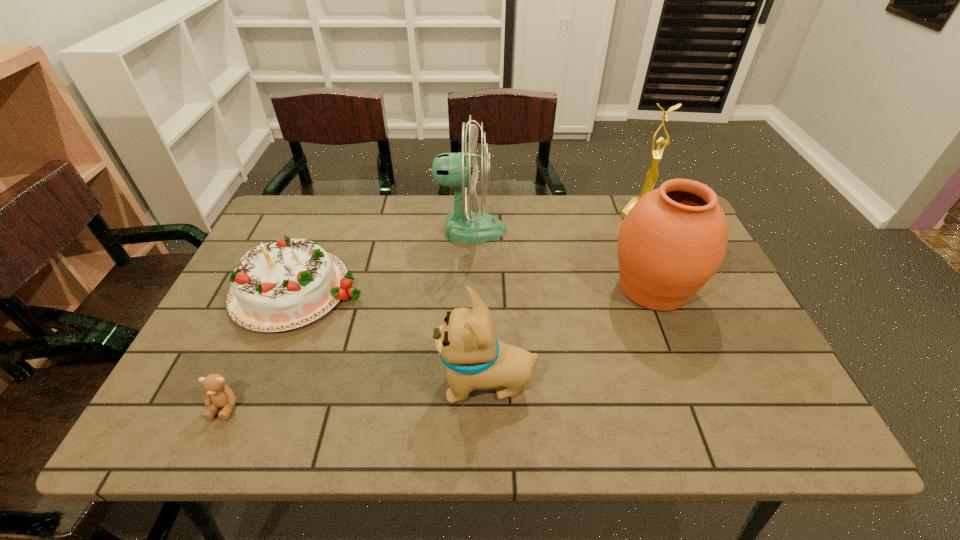
What are the coordinates of `free space that satisfies the following two spatial constraints: 1. in front of the fan, directing airflow; 2. on the front side of the second shortest object` in the screenshot? It's located at (468, 288).

Find the location of a particular element. free space that satisfies the following two spatial constraints: 1. on the face of the fourth tallest object; 2. on the face of the teddy bear is located at coordinates (487, 407).

I want to click on free spot that satisfies the following two spatial constraints: 1. on the face of the puppy; 2. on the face of the teddy bear, so click(x=487, y=407).

The width and height of the screenshot is (960, 540). Identify the location of vacant region that satisfies the following two spatial constraints: 1. in front of the fan, directing airflow; 2. on the back side of the urn. pyautogui.click(x=468, y=287).

Where is `free location that satisfies the following two spatial constraints: 1. on the front-facing side of the award; 2. on the face of the fourth tallest object`? This screenshot has width=960, height=540. free location that satisfies the following two spatial constraints: 1. on the front-facing side of the award; 2. on the face of the fourth tallest object is located at coordinates coord(714,383).